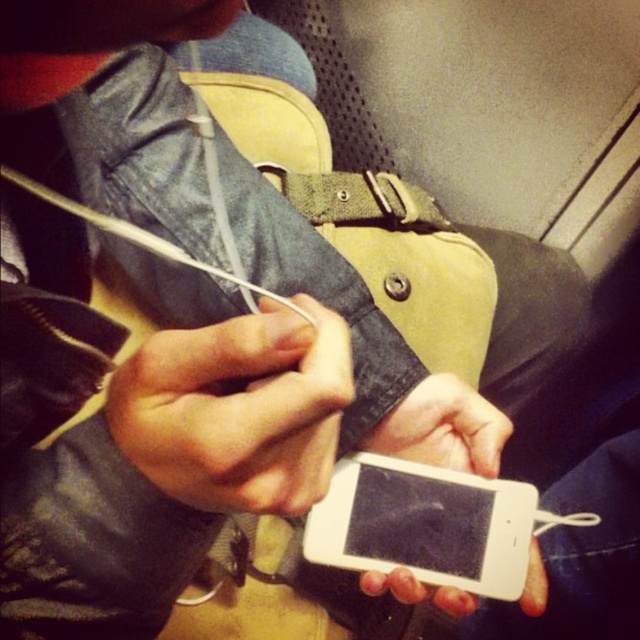
Can you confirm if matte black phone at center is taller than white matte phone at center?

Incorrect, matte black phone at center's height is not larger of white matte phone at center's.

In the scene shown: Who is positioned more to the right, matte black phone at center or white matte phone at center?

white matte phone at center

Between point (129, 444) and point (474, 420), which one is positioned behind?

Point (474, 420)

Where is `matte black phone at center`? The width and height of the screenshot is (640, 640). matte black phone at center is located at coordinates (237, 410).